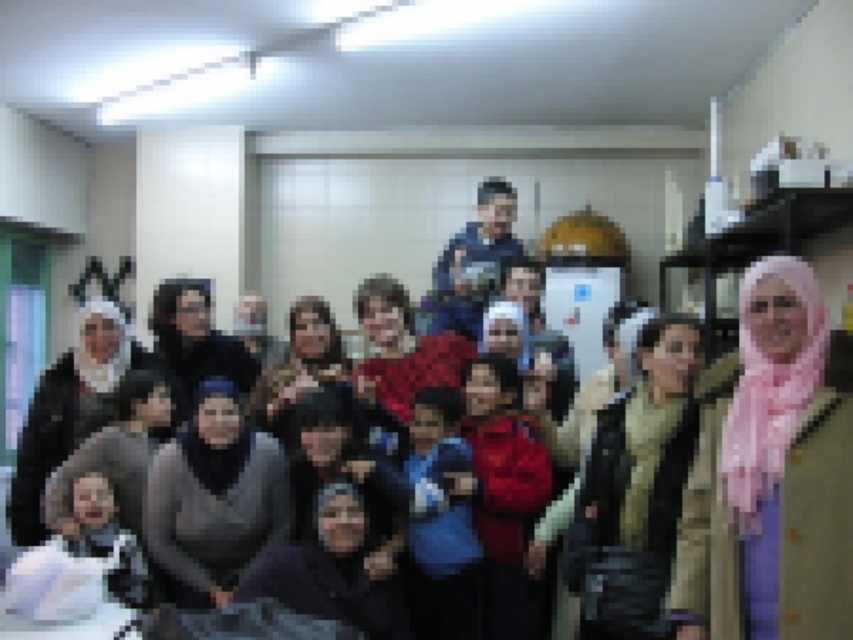
Which is above, pink fabric hijab at center or gray matte hijab at center?

pink fabric hijab at center is above.

Between pink fabric hijab at center and gray matte hijab at center, which one has more height?

With more height is pink fabric hijab at center.

The image size is (853, 640). What do you see at coordinates (787, 460) in the screenshot? I see `pink fabric hijab at center` at bounding box center [787, 460].

Locate an element on the screen. The height and width of the screenshot is (640, 853). pink fabric hijab at center is located at coordinates (787, 460).